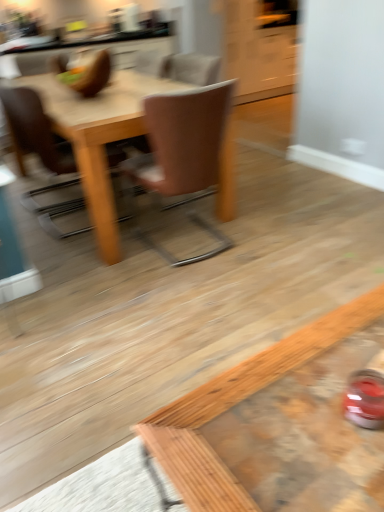
Find the location of a particular element. The width and height of the screenshot is (384, 512). vacant area that is in front of brown leather chair at upper left, acting as the second chair starting from the right is located at coordinates (74, 250).